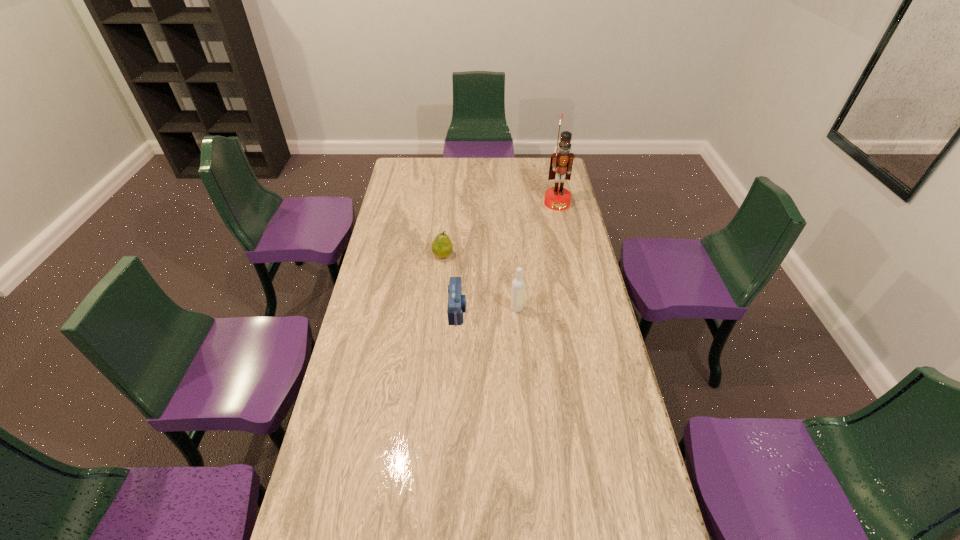
In order to click on vacant area situated on the lens of the shortest object in this screenshot , I will do `click(553, 310)`.

Where is `object situated at the right edge`? The image size is (960, 540). object situated at the right edge is located at coordinates (557, 198).

This screenshot has width=960, height=540. I want to click on vacant space at the far edge of the desktop, so click(444, 170).

This screenshot has height=540, width=960. In order to click on vacant space at the left edge of the desktop in this screenshot , I will do `click(386, 291)`.

At what (x,y) coordinates should I click in order to perform the action: click on vacant space at the right edge of the desktop. Please return your answer as a coordinate pair (x, y). Looking at the image, I should click on (606, 533).

In order to click on vacant space at the far left corner of the desktop in this screenshot , I will do `click(398, 173)`.

In the image, there is a desktop. Where is `free region at the far right corner`? This screenshot has height=540, width=960. free region at the far right corner is located at coordinates (543, 162).

Locate an element on the screen. This screenshot has width=960, height=540. free spot between the second object from right to left and the rightmost object is located at coordinates (537, 256).

Find the location of `free spot between the camera and the third shortest object`. free spot between the camera and the third shortest object is located at coordinates (487, 309).

I want to click on empty location between the nutcracker and the vodka, so click(537, 256).